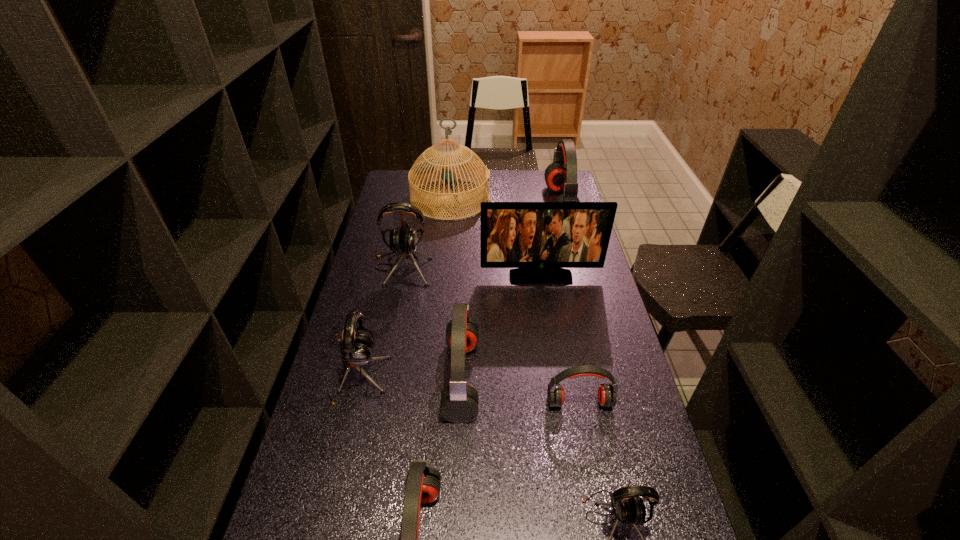
Choose which object is the seventh nearest neighbor to the nearest red earphone. Please provide its 2D coordinates. Your answer should be formatted as a tuple, i.e. [(x, y)], where the tuple contains the x and y coordinates of a point satisfying the conditions above.

[(425, 166)]

The image size is (960, 540). Identify the location of earphone that is the fifth closest to the birdcage. [x=607, y=397].

Point out which earphone is positioned as the fourth nearest to the nearest red earphone. Please provide its 2D coordinates. Your answer should be formatted as a tuple, i.e. [(x, y)], where the tuple contains the x and y coordinates of a point satisfying the conditions above.

[(607, 397)]

Identify which red earphone is located as the nearest to the nearest red earphone. Please provide its 2D coordinates. Your answer should be formatted as a tuple, i.e. [(x, y)], where the tuple contains the x and y coordinates of a point satisfying the conditions above.

[(459, 403)]

Locate an element on the screen. red earphone that is the second closest one to the second smallest black earphone is located at coordinates (423, 483).

This screenshot has width=960, height=540. I want to click on the closest black earphone to the farthest red earphone, so click(403, 241).

Point out which black earphone is positioned as the nearest to the birdcage. Please provide its 2D coordinates. Your answer should be formatted as a tuple, i.e. [(x, y)], where the tuple contains the x and y coordinates of a point satisfying the conditions above.

[(403, 241)]

Identify the location of blank space that satisfies the following two spatial constraints: 1. on the front-facing side of the monitor; 2. on the ear cups of the third smallest red earphone. (557, 378).